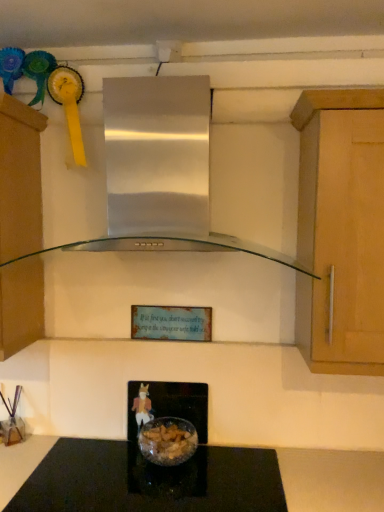
This screenshot has height=512, width=384. What are the coordinates of `vacant region above black glass countertop at center (from a real-world perspective)` in the screenshot? It's located at (131, 470).